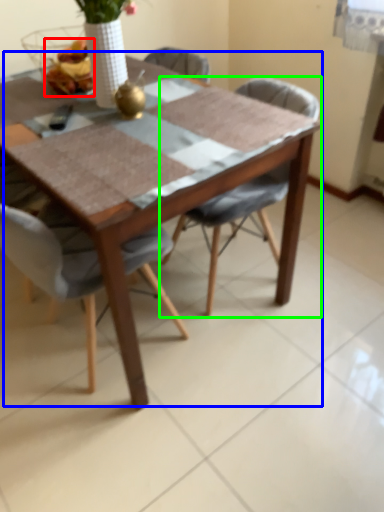
Question: Estimate the real-world distances between objects in this image. Which object is farther from food (highlighted by a red box), table (highlighted by a blue box) or chair (highlighted by a green box)?

Choices:
 (A) table
 (B) chair

Answer: (B)